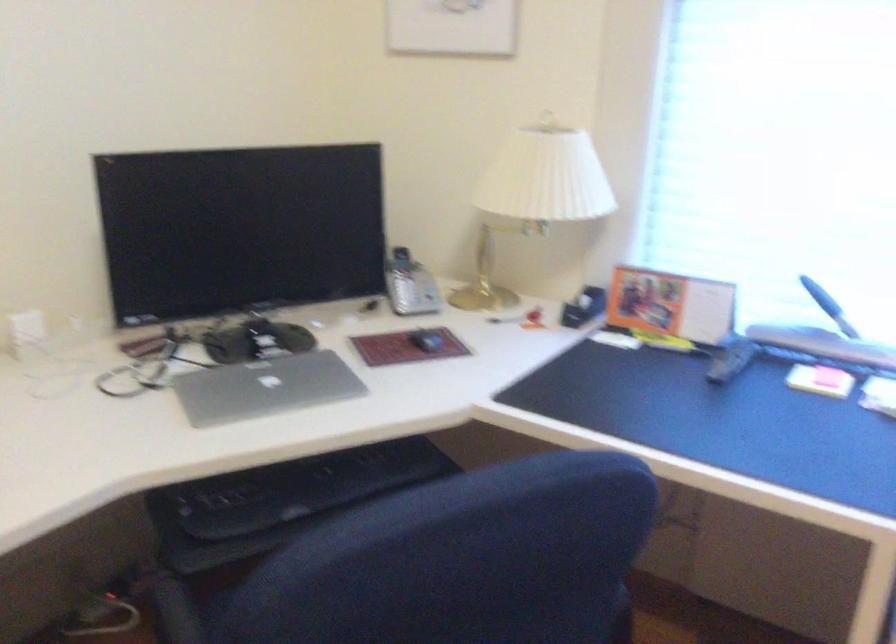
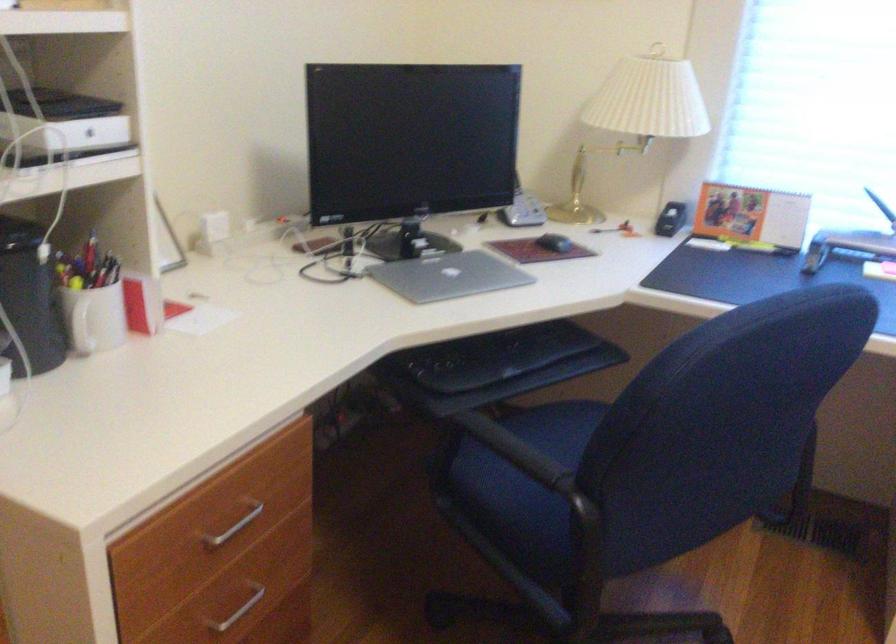
The point at (421, 339) is marked in the first image. Where is the corresponding point in the second image?

(554, 243)